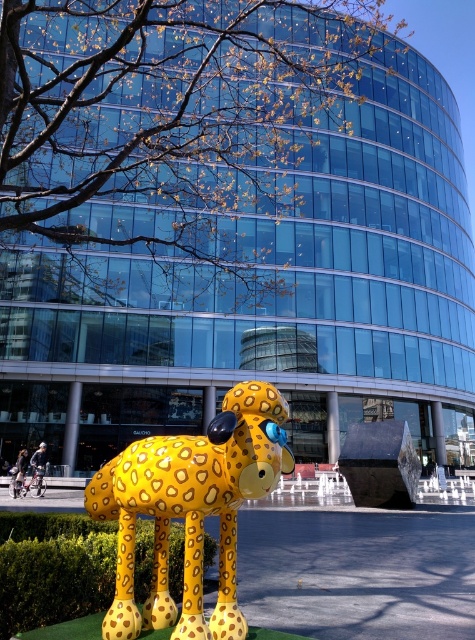
Which is above, yellow spotted dog at center or green hedge at lower left?

Positioned higher is yellow spotted dog at center.

Is yellow spotted dog at center taller than green hedge at lower left?

Correct, yellow spotted dog at center is much taller as green hedge at lower left.

In order to click on yellow spotted dog at center in this screenshot , I will do `click(190, 509)`.